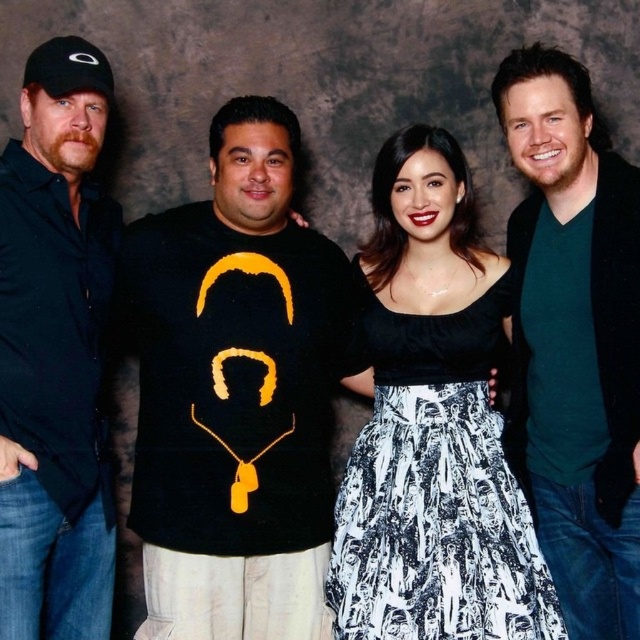
Which is behind, point (618, 372) or point (17, 285)?

The point (17, 285) is behind.

Does green matte shirt at right appear over black matte shirt at left?

Correct, green matte shirt at right is located above black matte shirt at left.

The width and height of the screenshot is (640, 640). Identify the location of green matte shirt at right. (577, 339).

Who is taller, black satin dress at center or black matte t-shirt at left?

black matte t-shirt at left is taller.

Is point (467, 604) less distant than point (35, 113)?

That is True.

Locate an element on the screen. black satin dress at center is located at coordinates (433, 426).

Which is below, black satin dress at center or black matte shirt at left?

Positioned lower is black satin dress at center.

Does black satin dress at center have a greater width compared to black matte shirt at left?

Correct, the width of black satin dress at center exceeds that of black matte shirt at left.

Does point (387, 365) come closer to viewer compared to point (26, 552)?

No, (387, 365) is behind (26, 552).

Locate an element on the screen. Image resolution: width=640 pixels, height=640 pixels. black satin dress at center is located at coordinates (433, 426).